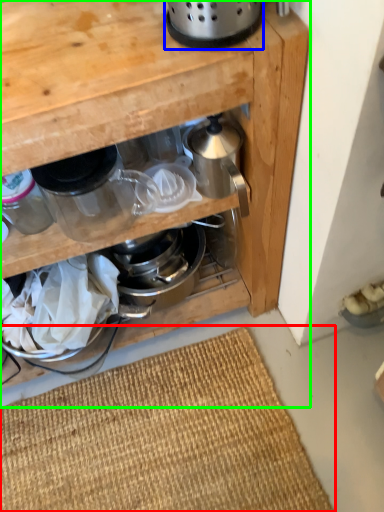
Question: Estimate the real-world distances between objects in this image. Which object is farther from doormat (highlighted by a red box), appliance (highlighted by a blue box) or cabinetry (highlighted by a green box)?

Choices:
 (A) appliance
 (B) cabinetry

Answer: (A)